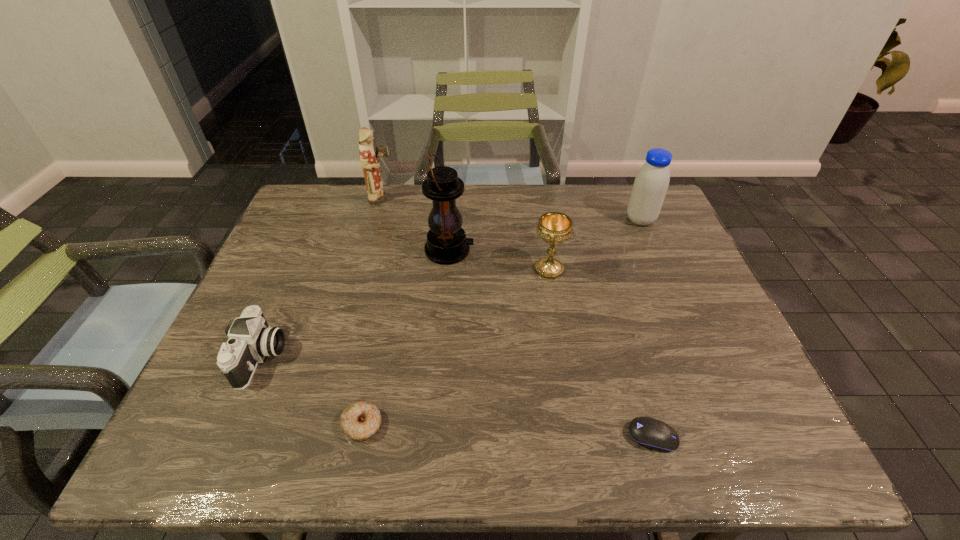
Find the location of a particular element. The height and width of the screenshot is (540, 960). free space that is in between the fifth farthest object and the rightmost object is located at coordinates (451, 289).

Identify which object is located as the fifth nearest to the fourth object from right to left. Please provide its 2D coordinates. Your answer should be formatted as a tuple, i.e. [(x, y)], where the tuple contains the x and y coordinates of a point satisfying the conditions above.

[(651, 183)]

Where is `object that stands as the sixth closest to the lantern`? object that stands as the sixth closest to the lantern is located at coordinates (648, 432).

Identify the location of free space that satisfies the following two spatial constraints: 1. on the front-facing side of the doughnut; 2. on the right side of the farthest object. (319, 424).

You are a GUI agent. You are given a task and a screenshot of the screen. Output one action in this format:
    pyautogui.click(x=<x>, y=<y>)
    Task: Click on the free spot that satisfies the following two spatial constraints: 1. on the back side of the sixth nearest object; 2. on the left side of the fifth object from left to right
    
    Given the screenshot: What is the action you would take?
    pyautogui.click(x=540, y=220)

Identify the location of free space that satisfies the following two spatial constraints: 1. on the back side of the fourth tallest object; 2. on the front-facing side of the figurine. (538, 199).

Identify the location of free space that satisfies the following two spatial constraints: 1. on the back side of the soya milk; 2. on the left side of the doughnut. (404, 220).

The width and height of the screenshot is (960, 540). In order to click on blank space that satisfies the following two spatial constraints: 1. on the back side of the computer mouse; 2. above the fourth object from left to right, indicating its light source in this screenshot , I will do `click(598, 250)`.

The image size is (960, 540). Identify the location of free location that satisfies the following two spatial constraints: 1. on the back side of the doughnut; 2. on the right side of the sixth nearest object. (404, 220).

At what (x,y) coordinates should I click in order to perform the action: click on free spot that satisfies the following two spatial constraints: 1. above the fourth object from right to left, indicating its light source; 2. on the left side of the fifth object from left to right. Please return your answer as a coordinate pair (x, y). Looking at the image, I should click on (x=447, y=269).